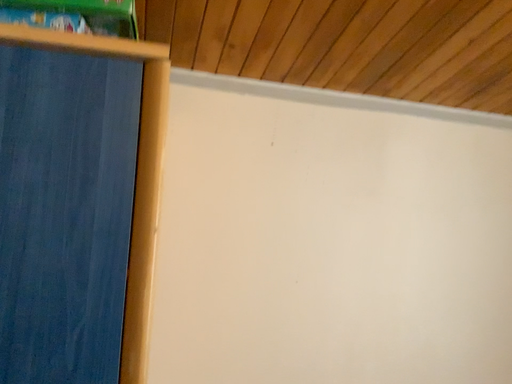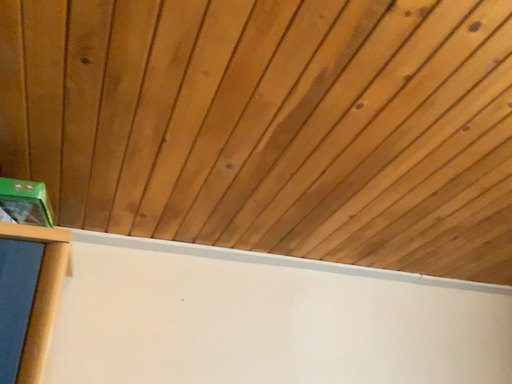
Question: How did the camera likely rotate when shooting the video?

Choices:
 (A) rotated upward
 (B) rotated downward

Answer: (A)